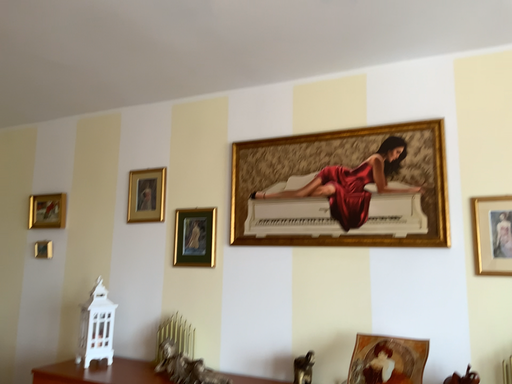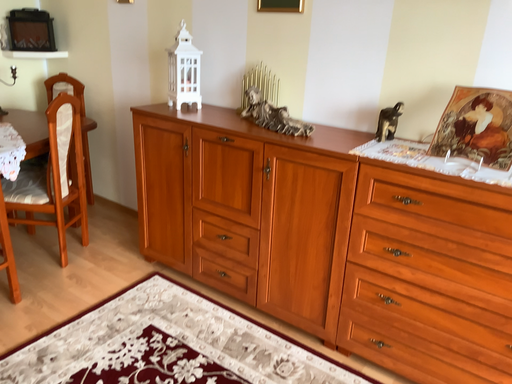
Question: Which way did the camera rotate in the video?

Choices:
 (A) rotated left
 (B) rotated right

Answer: (A)